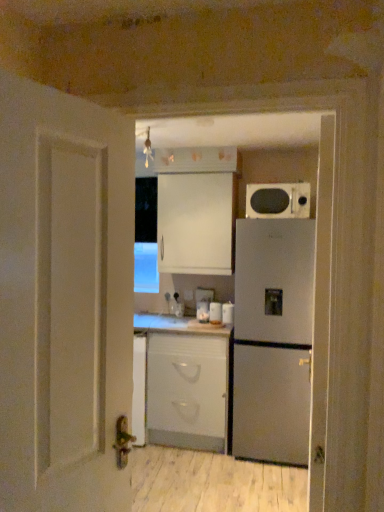
Question: Which direction should I rotate to look at white glossy canister at center, which is the first appliance in right-to-left order?

Choices:
 (A) left
 (B) right

Answer: (B)

Question: Is satin silver refrigerator at right taller than white matte cabinet at upper center, positioned as the first cabinetry in top-to-bottom order?

Choices:
 (A) yes
 (B) no

Answer: (A)

Question: Is satin silver refrigerator at right smaller than white matte cabinet at upper center, arranged as the second cabinetry when ordered from the bottom?

Choices:
 (A) yes
 (B) no

Answer: (B)

Question: Is satin silver refrigerator at right located outside white matte cabinet at upper center, arranged as the second cabinetry when ordered from the bottom?

Choices:
 (A) no
 (B) yes

Answer: (B)

Question: Is satin silver refrigerator at right thinner than white matte cabinet at upper center, positioned as the first cabinetry in top-to-bottom order?

Choices:
 (A) yes
 (B) no

Answer: (B)

Question: Would you say white matte cabinet at upper center, arranged as the second cabinetry when ordered from the bottom, is part of satin silver refrigerator at right's contents?

Choices:
 (A) yes
 (B) no

Answer: (B)

Question: Does satin silver refrigerator at right come in front of white matte cabinet at upper center, arranged as the second cabinetry when ordered from the bottom?

Choices:
 (A) no
 (B) yes

Answer: (B)

Question: Considering the relative sizes of matte black microwave at upper right and white matte cabinet at center, which ranks as the 2th cabinetry in top-to-bottom order, in the image provided, is matte black microwave at upper right taller than white matte cabinet at center, which ranks as the 2th cabinetry in top-to-bottom order,?

Choices:
 (A) no
 (B) yes

Answer: (A)

Question: Is matte black microwave at upper right not within white matte cabinet at center, which is the 1th cabinetry from bottom to top?

Choices:
 (A) no
 (B) yes

Answer: (B)

Question: Would you say white matte cabinet at center, which is the 1th cabinetry from bottom to top, is part of matte black microwave at upper right's contents?

Choices:
 (A) yes
 (B) no

Answer: (B)

Question: Is matte black microwave at upper right positioned far away from white matte cabinet at center, which ranks as the 2th cabinetry in top-to-bottom order?

Choices:
 (A) no
 (B) yes

Answer: (B)

Question: From a real-world perspective, does matte black microwave at upper right stand above white matte cabinet at center, which ranks as the 2th cabinetry in top-to-bottom order?

Choices:
 (A) no
 (B) yes

Answer: (B)

Question: Is the depth of matte black microwave at upper right less than that of white matte cabinet at center, which is the 1th cabinetry from bottom to top?

Choices:
 (A) no
 (B) yes

Answer: (B)

Question: Are white matte cabinet at upper center, arranged as the second cabinetry when ordered from the bottom, and white glossy jar at center, which is the third appliance in right-to-left order, far apart?

Choices:
 (A) no
 (B) yes

Answer: (A)